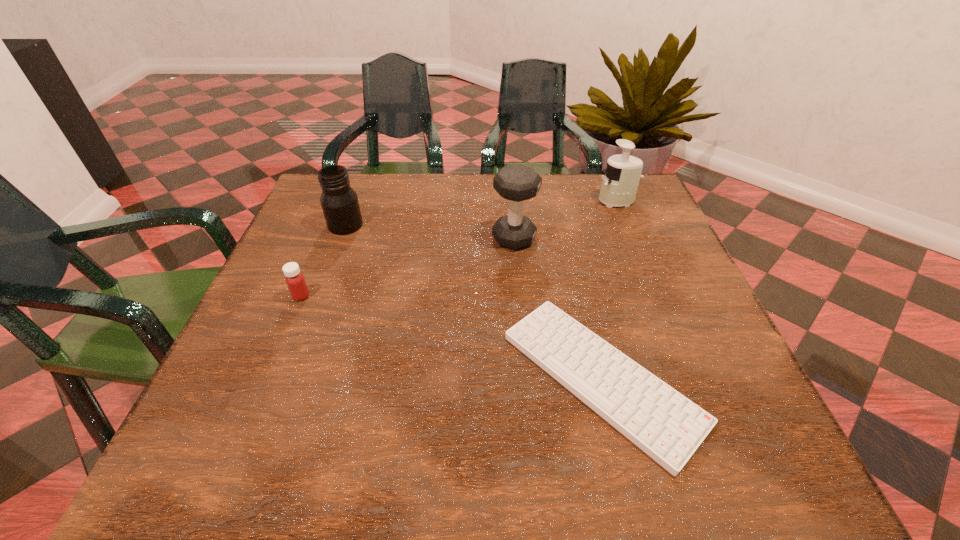
Where is `object that is at the far right corner`? This screenshot has width=960, height=540. object that is at the far right corner is located at coordinates click(621, 177).

Where is `object that is at the near right corner`? This screenshot has width=960, height=540. object that is at the near right corner is located at coordinates (667, 426).

Find the location of a particular element. The image size is (960, 540). vacant space at the far edge of the desktop is located at coordinates (492, 208).

In the image, there is a desktop. Where is `vacant space at the left edge`? vacant space at the left edge is located at coordinates (236, 348).

Where is `vacant area at the far right corner of the desktop`? The image size is (960, 540). vacant area at the far right corner of the desktop is located at coordinates (599, 214).

The height and width of the screenshot is (540, 960). What are the coordinates of `free spot between the dumbbell and the jar` in the screenshot? It's located at (430, 232).

Find the location of a particular element. This screenshot has height=540, width=960. vacant point located between the jar and the farthest object is located at coordinates (481, 213).

I want to click on free space between the jar and the computer keyboard, so click(x=473, y=301).

Where is `empty space that is in between the jar and the farthest object`? This screenshot has height=540, width=960. empty space that is in between the jar and the farthest object is located at coordinates (481, 213).

At what (x,y) coordinates should I click in order to perform the action: click on free spot between the shortest object and the farthest object. Please return your answer as a coordinate pair (x, y). This screenshot has height=540, width=960. Looking at the image, I should click on (609, 289).